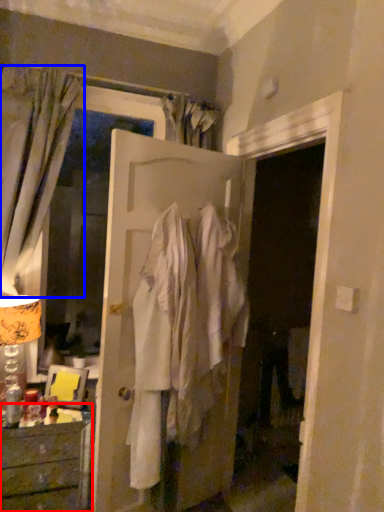
Question: Which object appears closest to the camera in this image, chest of drawers (highlighted by a red box) or curtain (highlighted by a blue box)?

Choices:
 (A) chest of drawers
 (B) curtain

Answer: (A)